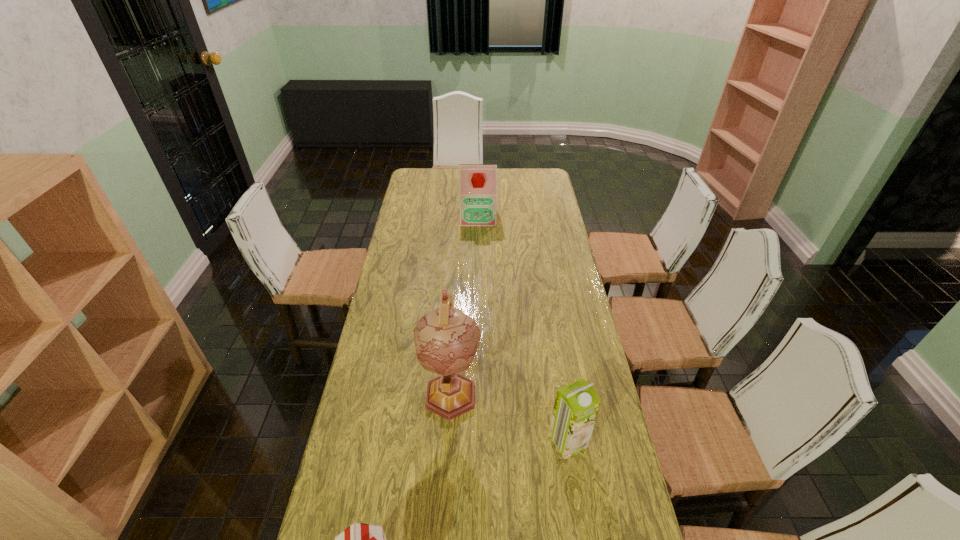
Where is `the closest object to the leftmost soya milk`? This screenshot has width=960, height=540. the closest object to the leftmost soya milk is located at coordinates (446, 339).

I want to click on the closest soya milk to the nearest soya milk, so click(x=576, y=406).

Locate an element on the screen. soya milk that is the closest to the second farthest soya milk is located at coordinates (359, 539).

The height and width of the screenshot is (540, 960). In order to click on vacant space that satisfies the following two spatial constraints: 1. with the cap open on the second nearest soya milk; 2. on the left side of the farthest soya milk in this screenshot , I will do 477,441.

Identify the location of vacant point that satisfies the following two spatial constraints: 1. with the cap open on the farthest object; 2. on the right side of the rightmost object. This screenshot has height=540, width=960. (477, 441).

At what (x,y) coordinates should I click in order to perform the action: click on free space that satisfies the following two spatial constraints: 1. on the front-facing side of the rightmost object; 2. on the left side of the tallest object. Please return your answer as a coordinate pair (x, y). Image resolution: width=960 pixels, height=540 pixels. Looking at the image, I should click on (448, 441).

Locate an element on the screen. Image resolution: width=960 pixels, height=540 pixels. free spot that satisfies the following two spatial constraints: 1. with the cap open on the farthest soya milk; 2. on the left side of the rightmost soya milk is located at coordinates (477, 441).